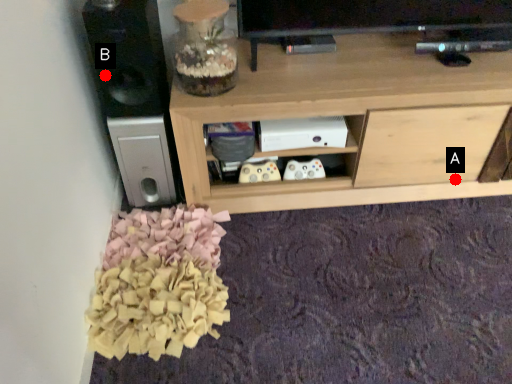
Question: Two points are circled on the image, labeled by A and B beside each circle. Which point is closer to the camera taking this photo?

Choices:
 (A) A is closer
 (B) B is closer

Answer: (B)